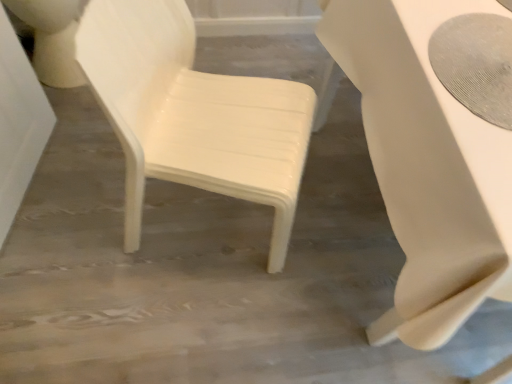
Where is `vacant area situated below white glossy chair at center (from a real-world perspective)`? Image resolution: width=512 pixels, height=384 pixels. vacant area situated below white glossy chair at center (from a real-world perspective) is located at coordinates (212, 223).